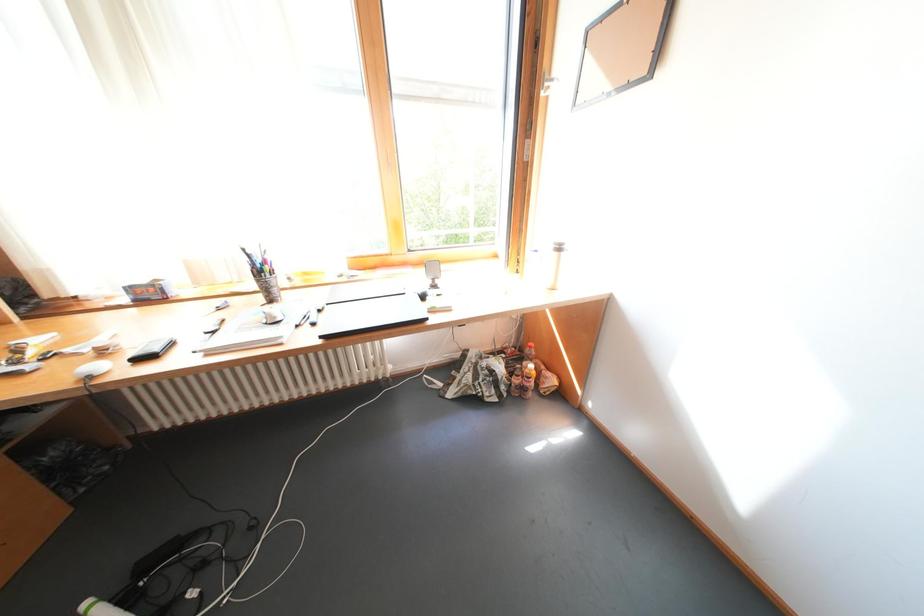
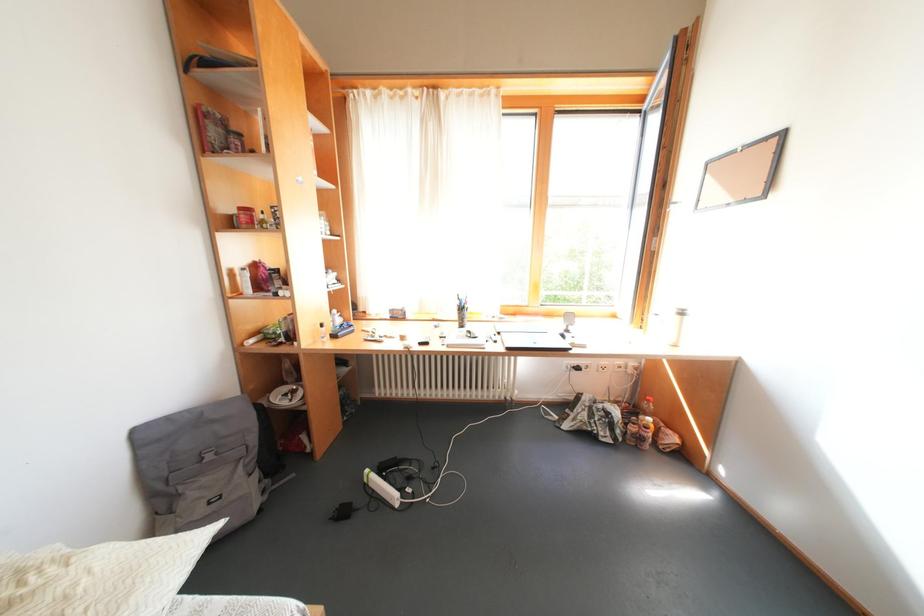
In a continuous first-person perspective shot, in which direction is the camera moving?

The movement direction of the cameraman is left, backward.